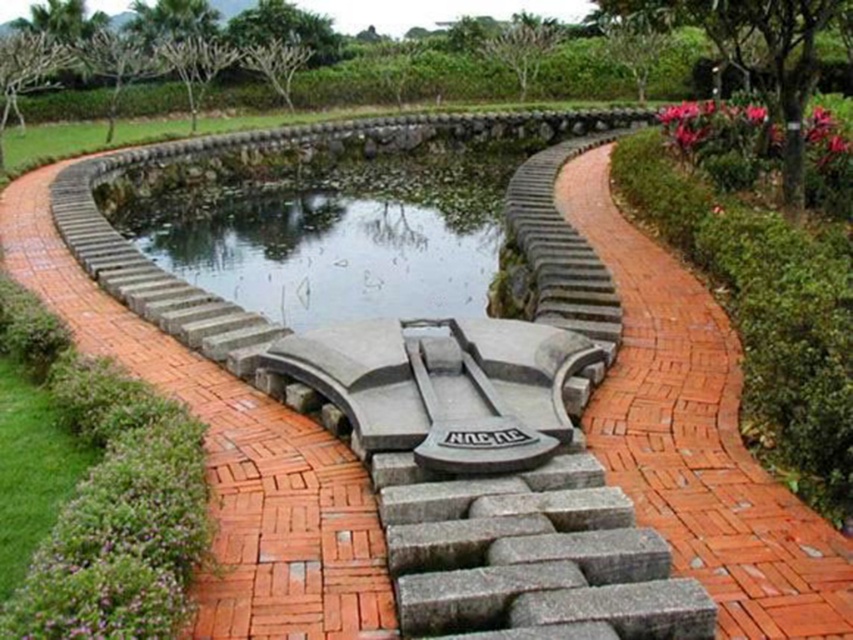
Which of these two, red brick pathway at center or gray stone bench at center, stands taller?

red brick pathway at center is taller.

I want to click on red brick pathway at center, so click(x=698, y=438).

You are a GUI agent. You are given a task and a screenshot of the screen. Output one action in this format:
    pyautogui.click(x=<x>, y=<y>)
    Task: Click on the red brick pathway at center
    
    Given the screenshot: What is the action you would take?
    pyautogui.click(x=698, y=438)

Does clear glass pond at center have a lesser width compared to gray stone bench at center?

No, clear glass pond at center is not thinner than gray stone bench at center.

Which is more to the right, clear glass pond at center or gray stone bench at center?

gray stone bench at center is more to the right.

The width and height of the screenshot is (853, 640). Identify the location of clear glass pond at center. (337, 236).

Does red brick pathway at center have a larger size compared to clear glass pond at center?

No.

Between red brick pathway at center and clear glass pond at center, which one is positioned higher?

clear glass pond at center is higher up.

You are a GUI agent. You are given a task and a screenshot of the screen. Output one action in this format:
    pyautogui.click(x=<x>, y=<y>)
    Task: Click on the red brick pathway at center
    Image resolution: width=853 pixels, height=640 pixels.
    Given the screenshot: What is the action you would take?
    pyautogui.click(x=698, y=438)

Where is `red brick pathway at center`? This screenshot has height=640, width=853. red brick pathway at center is located at coordinates (698, 438).